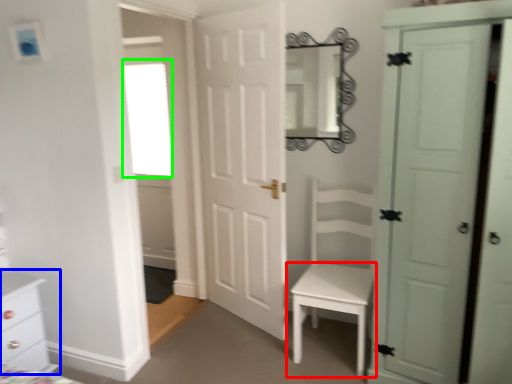
Question: Considering the real-world distances, which object is closest to table (highlighted by a red box)? chest of drawers (highlighted by a blue box) or window (highlighted by a green box).

Choices:
 (A) chest of drawers
 (B) window

Answer: (A)